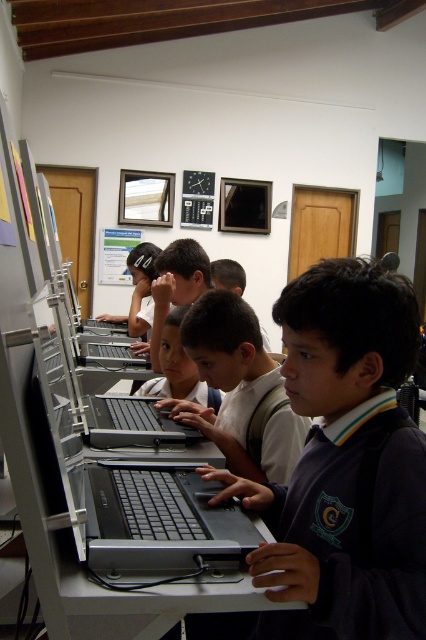
In the scene shown: You are a teacher in the classroom and want to place a new poster on the wall between the black matte laptop at center and the smooth skin child at center. Since the poster is 1 meter wide, will it fit between them?

The black matte laptop at center is smaller than the smooth skin child at center, but the exact distance between them isn not provided. Therefore, it is impossible to determine if the 1 meter wide poster will fit without knowing the actual space between the two.

You are a teacher in the classroom and want to check the screen of the black matte laptop at center without disturbing the smooth skin child at center. Which direction should you move to get a clear view of the laptop screen?

The black matte laptop at center is to the left of the smooth skin child at center, so the teacher should move to the left side of the laptop to view the screen without disturbing the child.